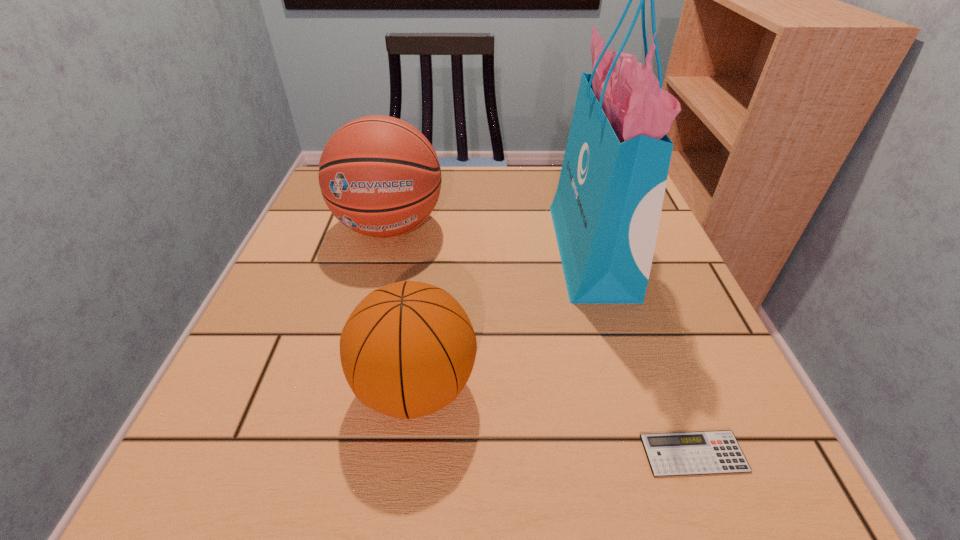
You are a GUI agent. You are given a task and a screenshot of the screen. Output one action in this format:
    pyautogui.click(x=<x>, y=<y>)
    Task: Click on the shopping bag positioned at the far edge
    
    Given the screenshot: What is the action you would take?
    pyautogui.click(x=606, y=211)

What are the coordinates of `basketball present at the far edge` in the screenshot? It's located at (379, 175).

Find the location of a particular element. basketball at the near edge is located at coordinates (407, 350).

This screenshot has height=540, width=960. I want to click on calculator present at the near edge, so click(x=703, y=452).

Find the location of a particular element. object present at the left edge is located at coordinates (379, 175).

Identify the location of shopping bag that is at the right edge. (606, 211).

Identify the location of calculator present at the right edge. pyautogui.click(x=703, y=452).

Where is `object that is positioned at the far left corner`? The image size is (960, 540). object that is positioned at the far left corner is located at coordinates (379, 175).

Where is `object located in the far right corner section of the desktop`? Image resolution: width=960 pixels, height=540 pixels. object located in the far right corner section of the desktop is located at coordinates (606, 211).

The width and height of the screenshot is (960, 540). In order to click on object at the near right corner in this screenshot , I will do `click(703, 452)`.